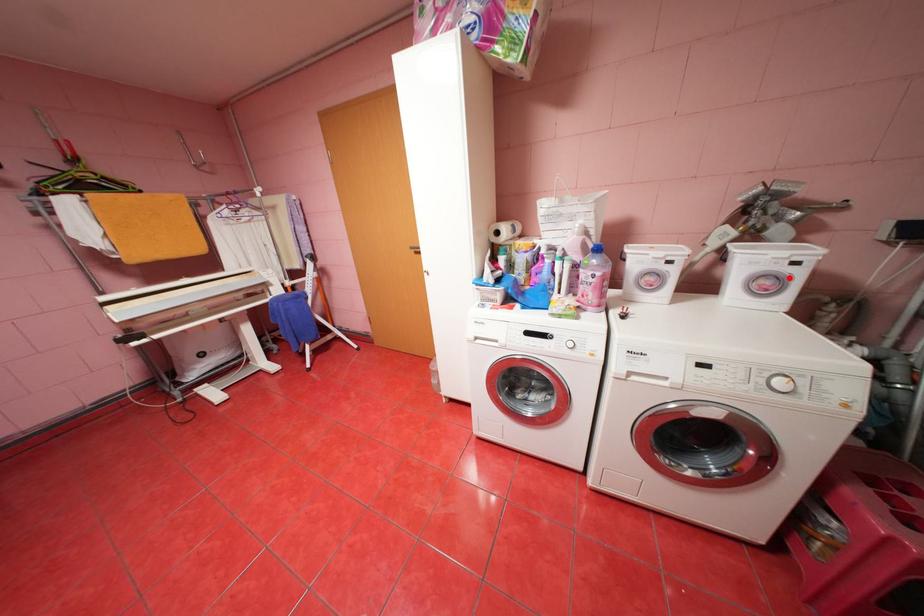
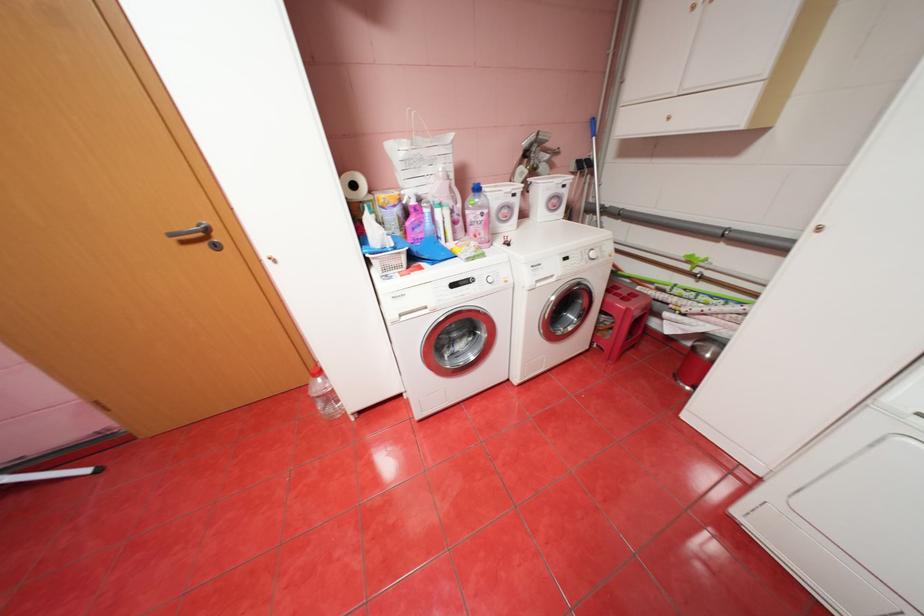
The point at the highlighted location is marked in the first image. Where is the corresponding point in the second image?

(566, 197)